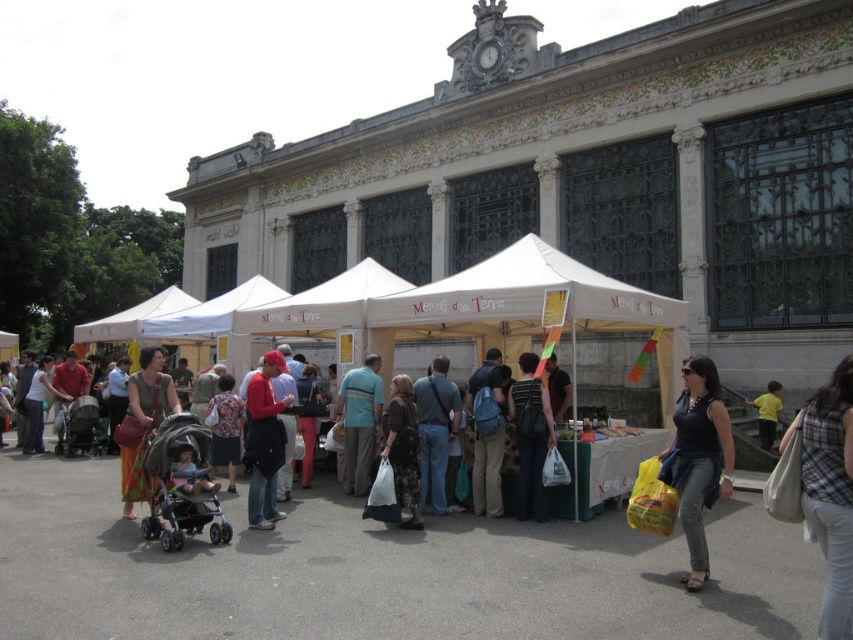
You are standing at the entrance of the ornate building and want to reach the point marked as point (775, 381). However, there is an obstacle at point (129, 481). Will you be able to walk directly to your destination without going around the obstacle?

Since point (129, 481) is in front of point (775, 381), you will encounter the obstacle first and thus cannot walk directly to your destination without going around it.

You are a photographer trying to capture a photo of the plaid fabric shirt at lower right and the silver metallic stroller at lower left. Which object is located more to the right side of the frame?

The plaid fabric shirt at lower right is positioned on the right side of the silver metallic stroller at lower left, so it is more to the right in the frame.